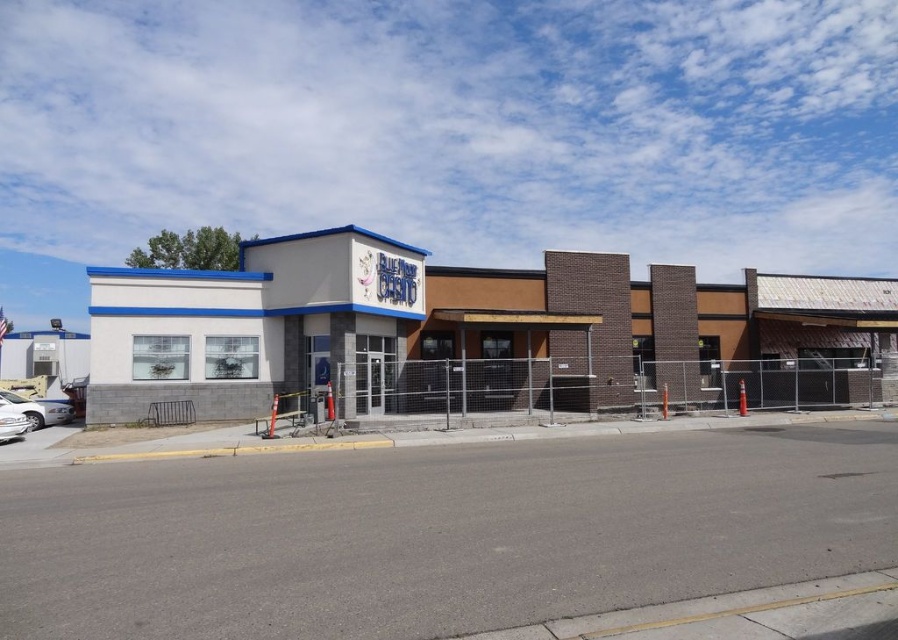
Question: Among these objects, which one is nearest to the camera?

Choices:
 (A) white glossy car at lower left
 (B) white brick building at left
 (C) silver metallic car at lower left

Answer: (C)

Question: Can you confirm if white glossy car at lower left is wider than silver metallic car at lower left?

Choices:
 (A) no
 (B) yes

Answer: (B)

Question: Is white brick building at left below white glossy car at lower left?

Choices:
 (A) yes
 (B) no

Answer: (B)

Question: Which point appears farthest from the camera in this image?

Choices:
 (A) (36, 420)
 (B) (14, 438)
 (C) (333, 340)

Answer: (A)

Question: In this image, where is white brick building at left located relative to silver metallic car at lower left?

Choices:
 (A) left
 (B) right

Answer: (B)

Question: Which point is closer to the camera?

Choices:
 (A) (9, 404)
 (B) (16, 436)
 (C) (603, 342)

Answer: (B)